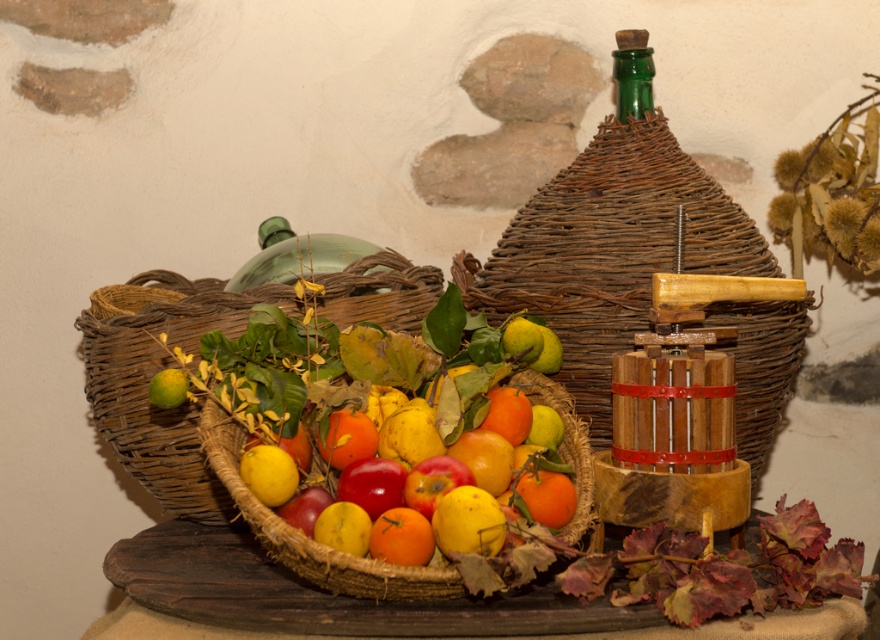
You are arranging fruits in the woven brown basket at center. You have a yellow matte apple at center that you want to place inside. Based on their sizes, will the apple fit comfortably inside the basket?

The woven brown basket at center has a larger size compared to the yellow matte apple at center, so the apple will fit comfortably inside the basket.

You are an artist setting up a still life. You have a glossy orange fruit at center and a green glass bottle at upper right. Which object is wider?

The glossy orange fruit at center is wider than the green glass bottle at upper right.

You are an artist setting up a still life. You have a yellow matte apple at center and a green matte lemon at left. Which fruit is located above the other?

The green matte lemon at left is above the yellow matte apple at center because the yellow matte apple at center is positioned under the green matte lemon at left.